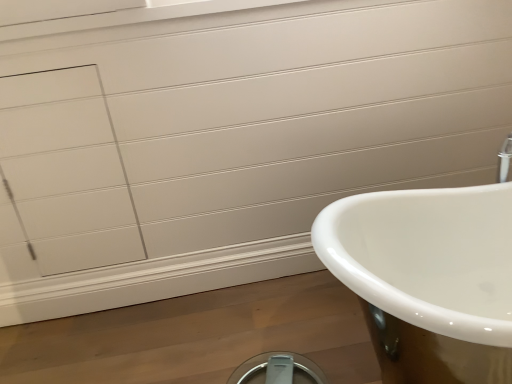
In order to click on white matte drawer at upper left in this screenshot , I will do `click(66, 171)`.

This screenshot has height=384, width=512. Describe the element at coordinates (66, 171) in the screenshot. I see `white matte drawer at upper left` at that location.

Measure the distance between white matte drawer at upper left and camera.

They are 1.60 meters apart.

This screenshot has height=384, width=512. Find the location of `white matte drawer at upper left`. white matte drawer at upper left is located at coordinates (66, 171).